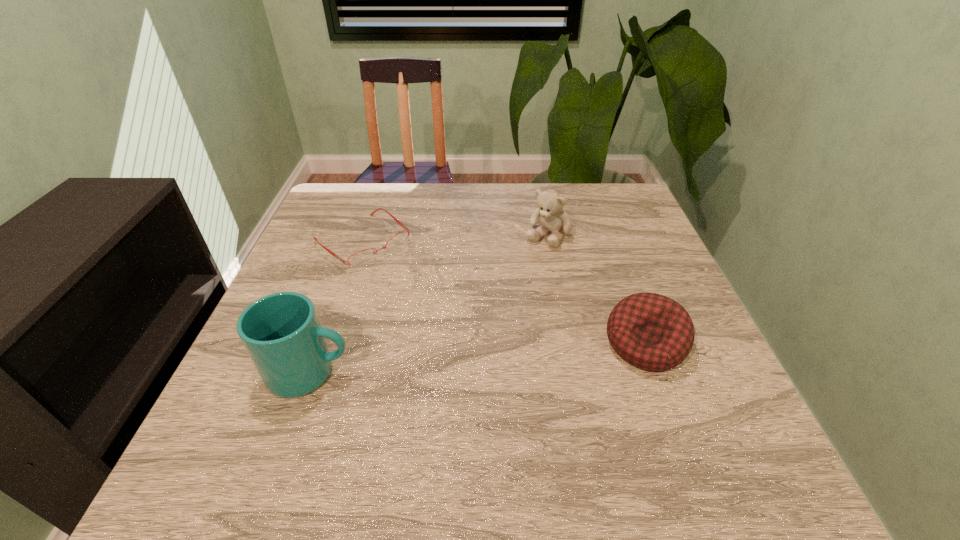
Where is `free spot on the desktop that is between the cup and the beanbag and is positioned on the face of the second object from right to left`? free spot on the desktop that is between the cup and the beanbag and is positioned on the face of the second object from right to left is located at coordinates (451, 360).

This screenshot has width=960, height=540. What are the coordinates of `free space on the desktop that is between the cup and the second shortest object and is positioned on the lenses of the shortest object` in the screenshot? It's located at (504, 356).